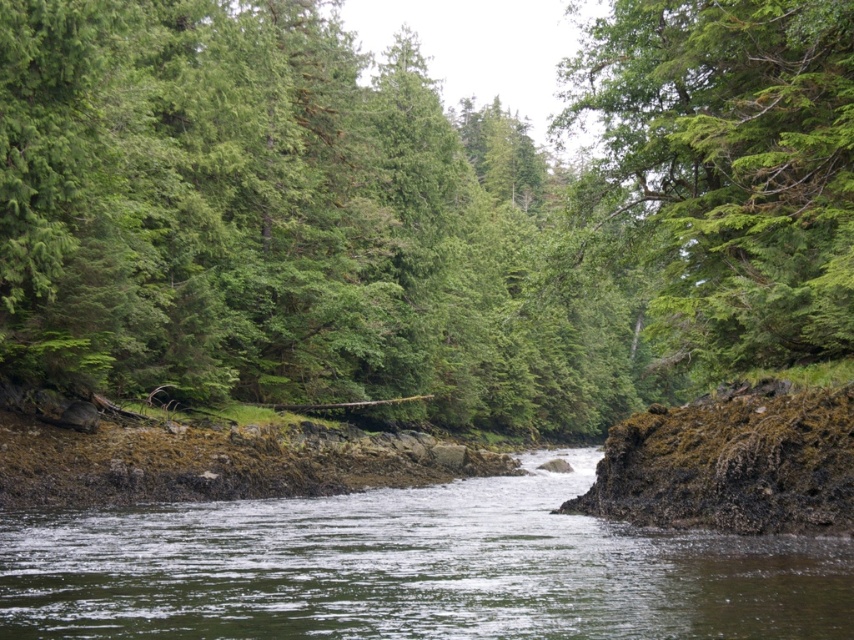
You are a bird flying over the river and want to land on a branch. You see a green leafy tree at center and a green leafy tree at upper center. Which tree is to the left of the other?

The green leafy tree at center is positioned on the left side of green leafy tree at upper center.

You are a hiker who wants to cross the river using the green mossy rock at center and the green leafy tree at upper center as landmarks. Which landmark is closer to the ground?

The green mossy rock at center is closer to the ground because it is not as tall as the green leafy tree at upper center.